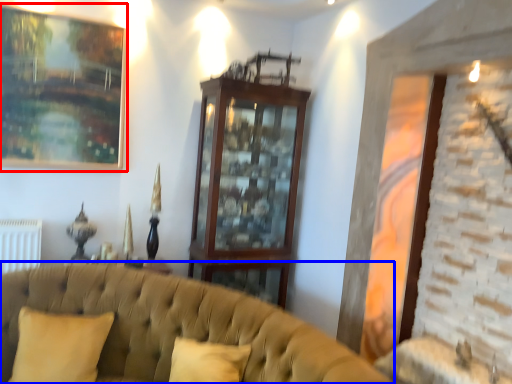
Question: Which point is closer to the camera, picture frame (highlighted by a red box) or studio couch (highlighted by a blue box)?

Choices:
 (A) picture frame
 (B) studio couch

Answer: (B)